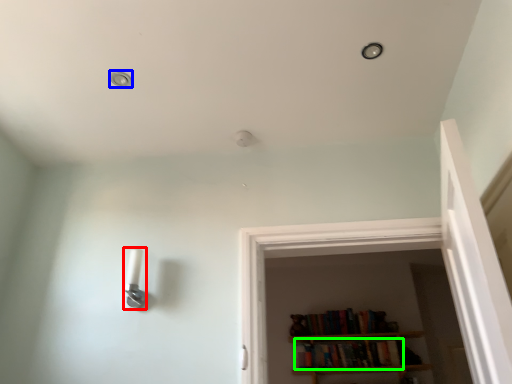
Question: Which object is the closest to the light fixture (highlighted by a red box)? Choose among these: dot (highlighted by a blue box) or book (highlighted by a green box).

Choices:
 (A) dot
 (B) book

Answer: (A)